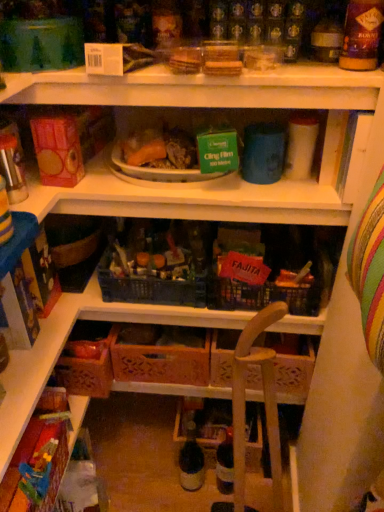
Question: Does multicolored fabric toy at lower left lie in front of white plastic plate at upper center?

Choices:
 (A) yes
 (B) no

Answer: (A)

Question: Is multicolored fabric toy at lower left taller than white plastic plate at upper center?

Choices:
 (A) yes
 (B) no

Answer: (A)

Question: Does multicolored fabric toy at lower left lie behind white plastic plate at upper center?

Choices:
 (A) no
 (B) yes

Answer: (A)

Question: Is multicolored fabric toy at lower left bigger than white plastic plate at upper center?

Choices:
 (A) yes
 (B) no

Answer: (B)

Question: Is multicolored fabric toy at lower left positioned with its back to white plastic plate at upper center?

Choices:
 (A) no
 (B) yes

Answer: (A)

Question: Is translucent glass bottle at center wider or thinner than multicolored fabric toy at lower left?

Choices:
 (A) wide
 (B) thin

Answer: (B)

Question: From a real-world perspective, is translucent glass bottle at center above or below multicolored fabric toy at lower left?

Choices:
 (A) below
 (B) above

Answer: (A)

Question: Do you think translucent glass bottle at center is within multicolored fabric toy at lower left, or outside of it?

Choices:
 (A) outside
 (B) inside

Answer: (A)

Question: Considering the positions of translucent glass bottle at center and multicolored fabric toy at lower left in the image, is translucent glass bottle at center bigger or smaller than multicolored fabric toy at lower left?

Choices:
 (A) small
 (B) big

Answer: (B)

Question: Choose the correct answer: Is orange plastic bowl at center inside multicolored fabric toy at lower left or outside it?

Choices:
 (A) outside
 (B) inside

Answer: (A)

Question: Does point (178, 159) appear closer or farther from the camera than point (48, 452)?

Choices:
 (A) closer
 (B) farther

Answer: (B)

Question: Looking at their shapes, would you say orange plastic bowl at center is wider or thinner than multicolored fabric toy at lower left?

Choices:
 (A) wide
 (B) thin

Answer: (A)

Question: In terms of height, does orange plastic bowl at center look taller or shorter compared to multicolored fabric toy at lower left?

Choices:
 (A) short
 (B) tall

Answer: (A)

Question: Visually, is wooden crate at center positioned to the left or to the right of multicolored fabric toy at lower left?

Choices:
 (A) left
 (B) right

Answer: (B)

Question: Is wooden crate at center in front of or behind multicolored fabric toy at lower left in the image?

Choices:
 (A) front
 (B) behind

Answer: (B)